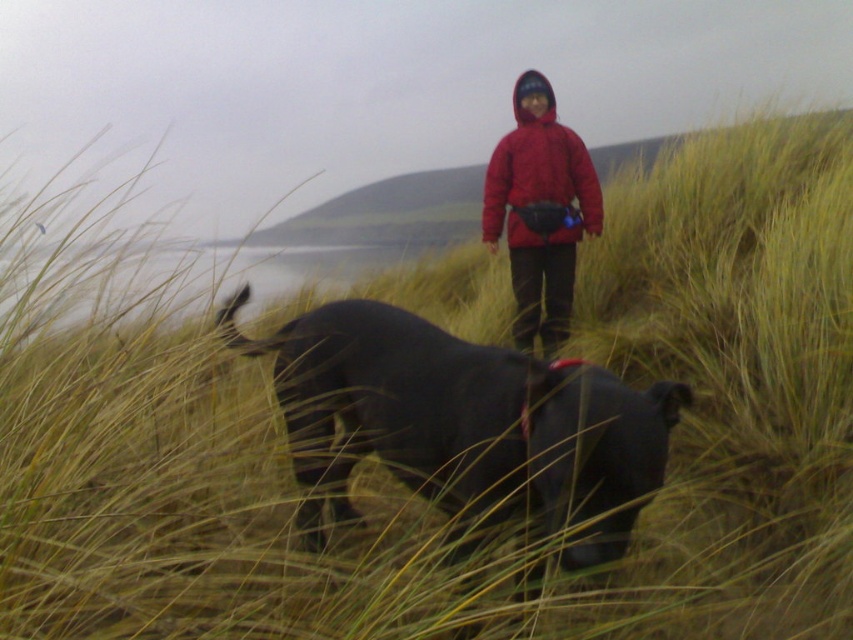
Question: Where is black matte dog at center located in relation to matte red jacket at center in the image?

Choices:
 (A) left
 (B) right

Answer: (A)

Question: Which point appears farthest from the camera in this image?

Choices:
 (A) (604, 396)
 (B) (520, 232)

Answer: (B)

Question: Among these objects, which one is farthest from the camera?

Choices:
 (A) matte red jacket at center
 (B) black matte dog at center

Answer: (A)

Question: Which point is farther to the camera?

Choices:
 (A) matte red jacket at center
 (B) black matte dog at center

Answer: (A)

Question: Is black matte dog at center to the right of matte red jacket at center from the viewer's perspective?

Choices:
 (A) no
 (B) yes

Answer: (A)

Question: Does black matte dog at center appear under matte red jacket at center?

Choices:
 (A) yes
 (B) no

Answer: (A)